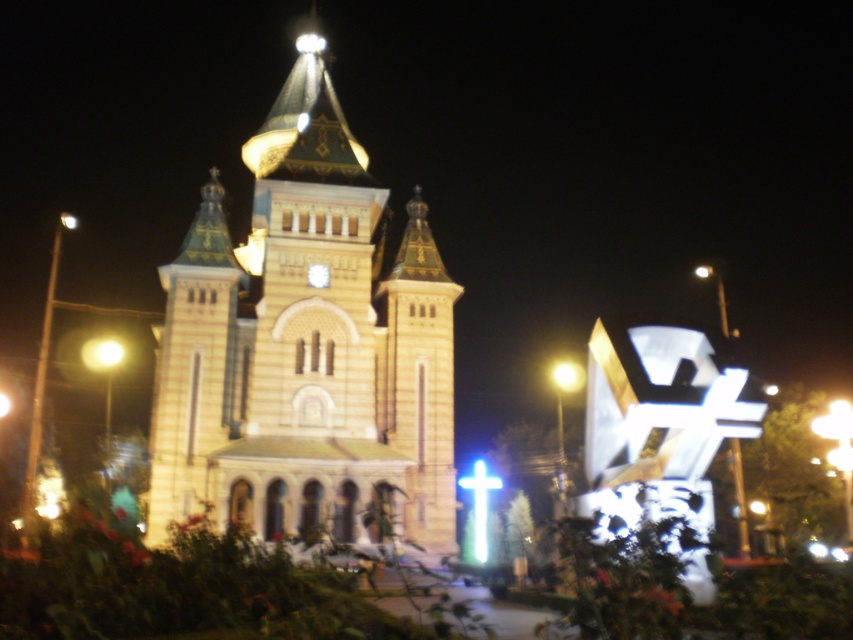
You are standing in front of the church and notice two elements in the center area. The golden stone church at center and the yellow matte light at center. Which one is positioned to the right?

The yellow matte light at center is positioned to the right of the golden stone church at center.

You are standing in front of the grand church at night. You notice the golden stone church at center and the yellow matte light at center. Which object is located above the other?

The golden stone church at center is positioned over the yellow matte light at center, meaning it is above the light.